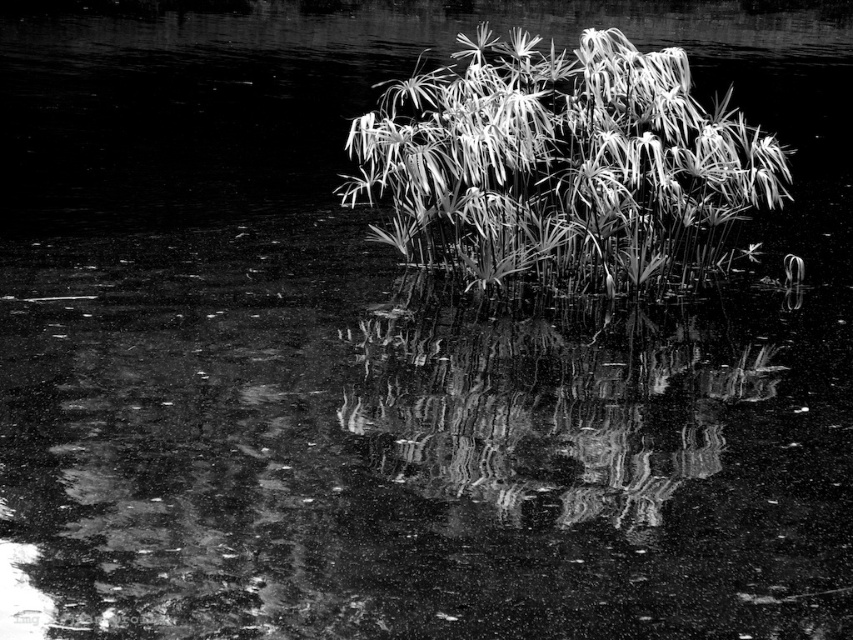
From the picture: You are a photographer standing at a certain distance from a silvery metallic plant at center in a serene black and white photo. If you want to capture the plant in focus without any blur, and your camera has a minimum focusing distance of 8 meters, will you need to move closer or farther away?

The silvery metallic plant at center is 7.74 meters away from the viewer. Since the camera requires a minimum focusing distance of 8 meters, you need to move farther away to reach at least 8 meters to focus properly.

You are an artist trying to sketch this scene. You want to ensure the silvery metallic plant at center and the smooth reflective water at center are proportionally accurate. Which object should you draw with finer detail to capture its slender form?

The silvery metallic plant at center is thinner than the smooth reflective water at center, so you should draw the silvery metallic plant at center with finer detail to capture its slender form.